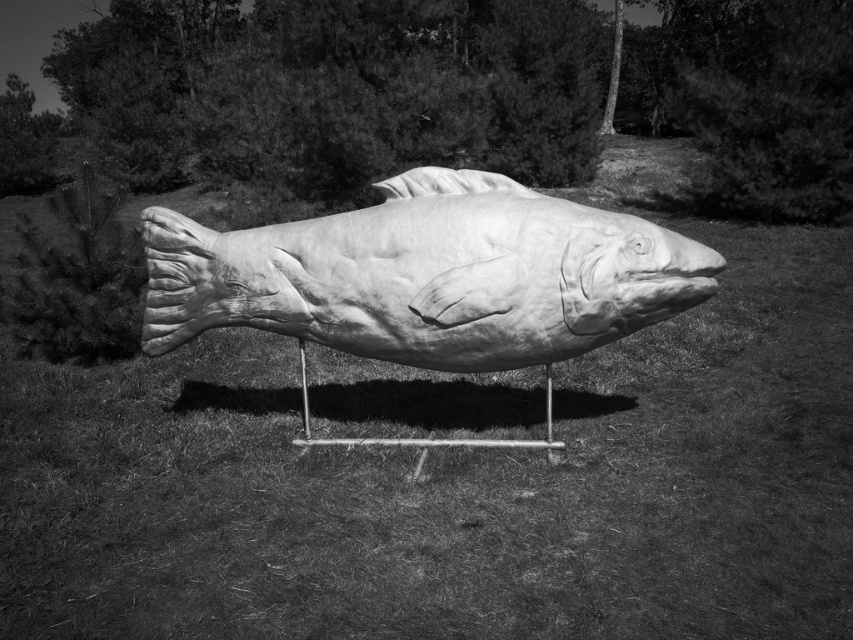
You are a gardener who wants to plant a new flower bed between the smooth grass at center and the smooth wood fish at center. Which object should you start modifying first if you want the flower bed to be level with the ground?

The smooth grass at center has a lesser height compared to smooth wood fish at center, so you should start modifying the smooth grass at center to match the height of the smooth wood fish at center to ensure the flower bed is level with the ground.

You are standing in front of the fish sculpture and want to take a photo. You notice two points on the sculpture labeled as point (x=22, y=486) and point (x=268, y=253). Which point will appear larger in your camera view?

Point (x=22, y=486) is closer to the camera than point (x=268, y=253), so it will appear larger in the camera view.